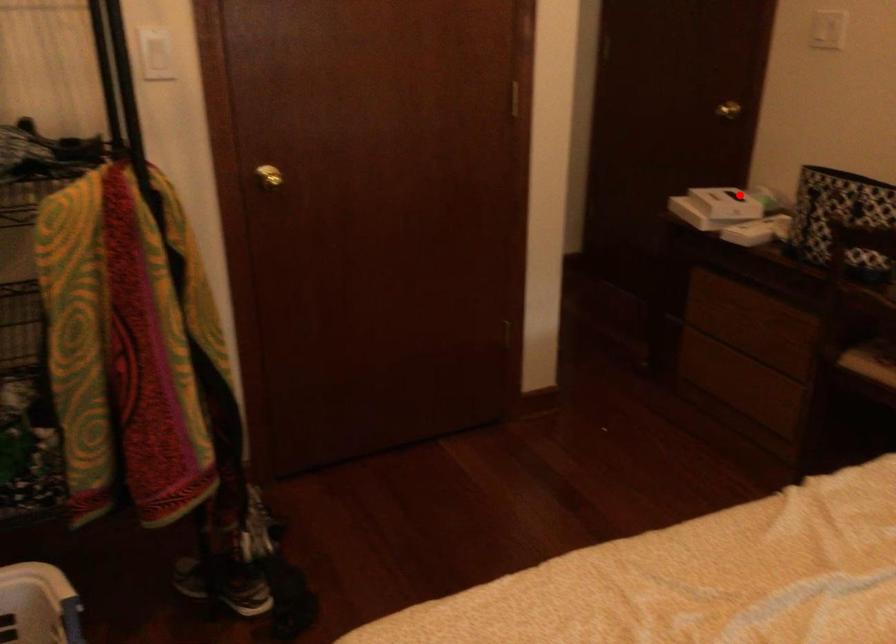
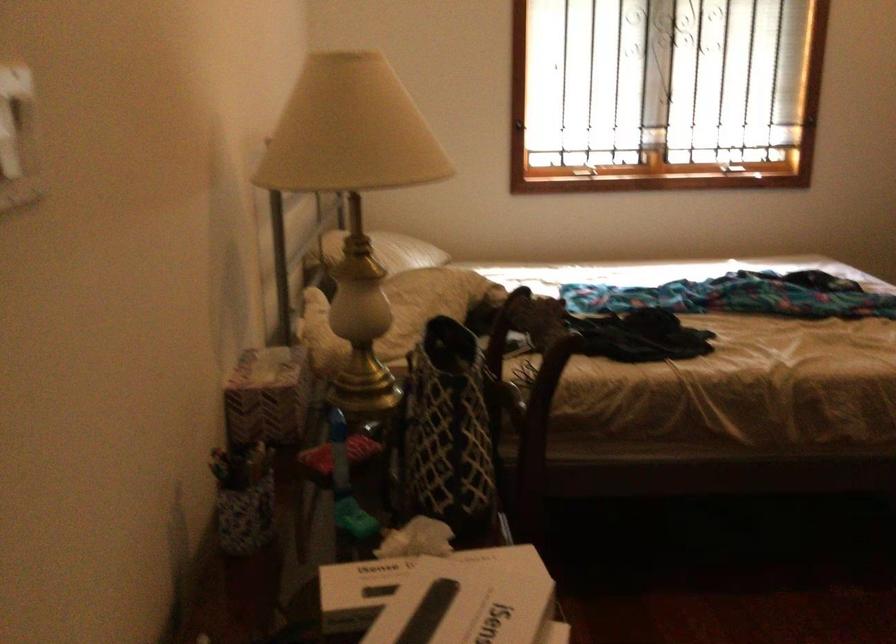
Question: A red point is marked in image1. In image2, is the corresponding 3D point closer to the camera or farther? Reply with the corresponding letter.

Choices:
 (A) The corresponding 3D point is closer.
 (B) The corresponding 3D point is farther.

Answer: (A)